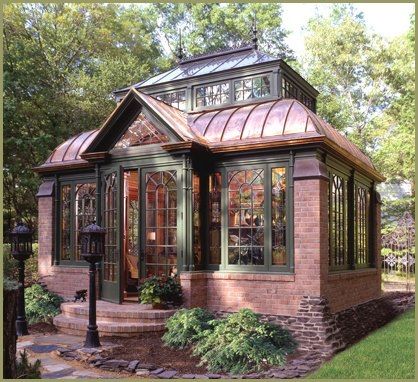
Where is `brick wall`? Image resolution: width=418 pixels, height=382 pixels. brick wall is located at coordinates (316, 247).